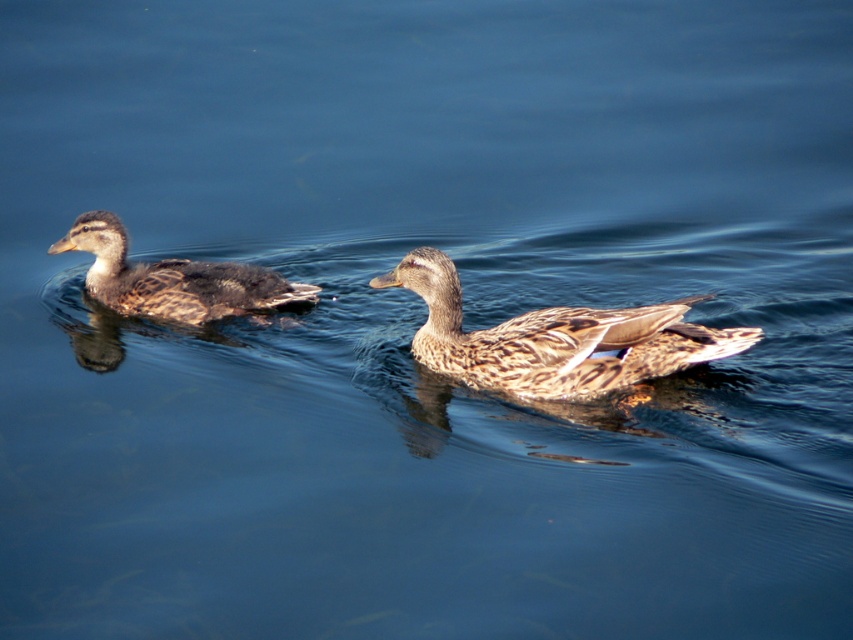
Question: Is brown speckled duck at center below brown speckled duck at left?

Choices:
 (A) no
 (B) yes

Answer: (B)

Question: Does brown speckled duck at center have a larger size compared to brown speckled duck at left?

Choices:
 (A) no
 (B) yes

Answer: (B)

Question: Which object appears closest to the camera in this image?

Choices:
 (A) brown speckled duck at center
 (B) brown speckled duck at left

Answer: (A)

Question: Can you confirm if brown speckled duck at center is wider than brown speckled duck at left?

Choices:
 (A) yes
 (B) no

Answer: (A)

Question: Which of the following is the closest to the observer?

Choices:
 (A) brown speckled duck at left
 (B) brown speckled duck at center

Answer: (B)

Question: Which point is closer to the camera taking this photo?

Choices:
 (A) (440, 356)
 (B) (247, 278)

Answer: (A)